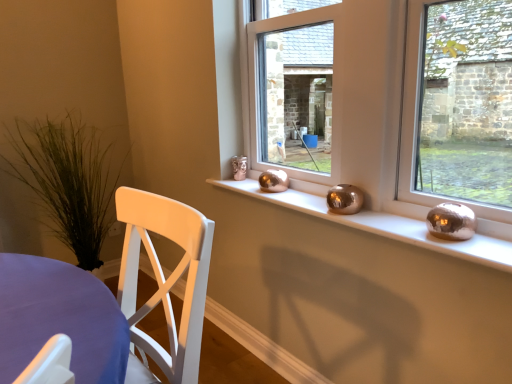
Question: Is metallic gold vase at center closer to camera compared to metallic spheres at center?

Choices:
 (A) yes
 (B) no

Answer: (B)

Question: Is metallic gold vase at center far from metallic spheres at center?

Choices:
 (A) yes
 (B) no

Answer: (B)

Question: From the image's perspective, is metallic gold vase at center on metallic spheres at center?

Choices:
 (A) no
 (B) yes

Answer: (B)

Question: Does metallic gold vase at center touch metallic spheres at center?

Choices:
 (A) yes
 (B) no

Answer: (B)

Question: Can you confirm if metallic gold vase at center is shorter than metallic spheres at center?

Choices:
 (A) yes
 (B) no

Answer: (B)

Question: In terms of height, does metallic spheres at center look taller or shorter compared to green grass at left?

Choices:
 (A) short
 (B) tall

Answer: (A)

Question: Considering the positions of metallic spheres at center and green grass at left in the image, is metallic spheres at center wider or thinner than green grass at left?

Choices:
 (A) wide
 (B) thin

Answer: (B)

Question: From the image's perspective, relative to green grass at left, is metallic spheres at center above or below?

Choices:
 (A) above
 (B) below

Answer: (B)

Question: Looking at the image, does metallic spheres at center seem bigger or smaller compared to green grass at left?

Choices:
 (A) small
 (B) big

Answer: (A)

Question: From the image's perspective, relative to metallic spheres at center, is green grass at left above or below?

Choices:
 (A) below
 (B) above

Answer: (B)

Question: Would you say green grass at left is inside or outside metallic spheres at center?

Choices:
 (A) inside
 (B) outside

Answer: (B)

Question: Is green grass at left to the left or to the right of metallic spheres at center in the image?

Choices:
 (A) left
 (B) right

Answer: (A)

Question: Considering the positions of point (28, 165) and point (294, 200), is point (28, 165) closer or farther from the camera than point (294, 200)?

Choices:
 (A) closer
 (B) farther

Answer: (B)

Question: Is metallic gold vase at center inside or outside of metallic spheres at center?

Choices:
 (A) inside
 (B) outside

Answer: (B)

Question: Is metallic gold vase at center wider or thinner than metallic spheres at center?

Choices:
 (A) thin
 (B) wide

Answer: (A)